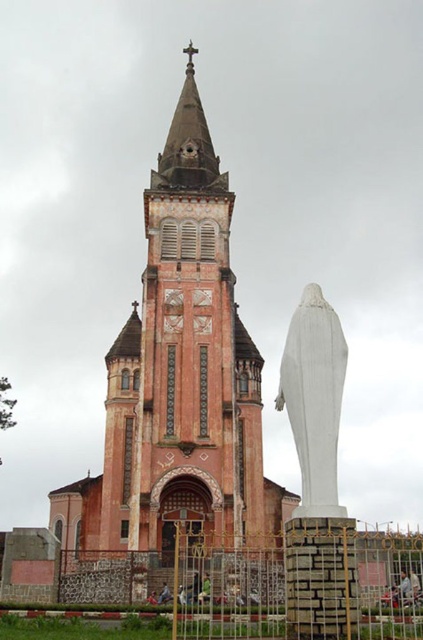
Question: Which point is farther to the camera?

Choices:
 (A) (181, 192)
 (B) (340, 403)

Answer: (A)

Question: Considering the relative positions of pink stone tower at center and white marble statue at center in the image provided, where is pink stone tower at center located with respect to white marble statue at center?

Choices:
 (A) left
 (B) right

Answer: (A)

Question: Which of the following is the farthest from the observer?

Choices:
 (A) (227, 260)
 (B) (299, 316)

Answer: (A)

Question: Is pink stone tower at center in front of white marble statue at center?

Choices:
 (A) yes
 (B) no

Answer: (B)

Question: Which of the following is the farthest from the observer?

Choices:
 (A) (316, 508)
 (B) (74, 554)

Answer: (B)

Question: From the image, what is the correct spatial relationship of pink stone tower at center in relation to white marble statue at center?

Choices:
 (A) left
 (B) right

Answer: (A)